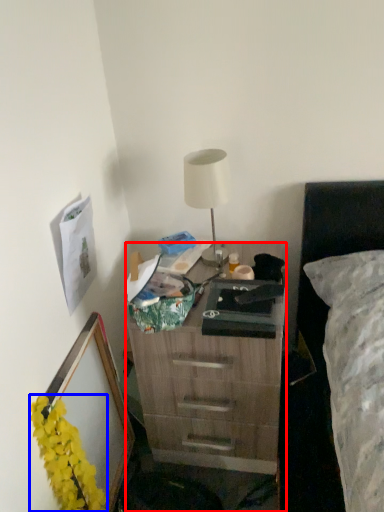
Question: Which object appears farthest to the camera in this image, desk (highlighted by a red box) or flower (highlighted by a blue box)?

Choices:
 (A) desk
 (B) flower

Answer: (A)